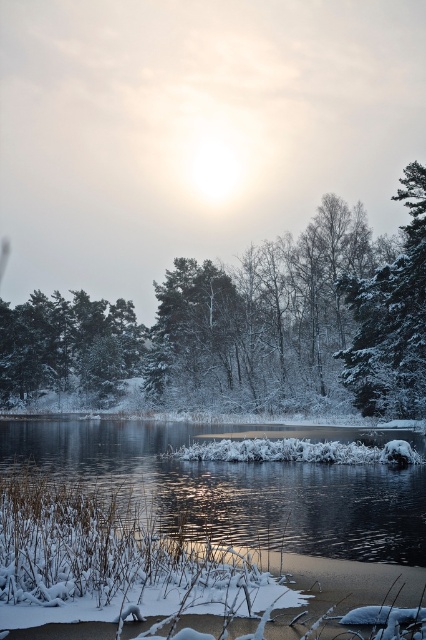
Which is above, snow-covered evergreen tree at right or green matte tree at upper left?

Answer: snow-covered evergreen tree at right is higher up.

Which is more to the left, snow-covered evergreen tree at right or green matte tree at upper left?

Positioned to the left is green matte tree at upper left.

Is point (396, 349) closer to camera compared to point (97, 314)?

That is True.

Find the location of a particular element. snow-covered evergreen tree at right is located at coordinates (391, 320).

Describe the element at coordinates (233, 490) in the screenshot. I see `clear ice water at lower center` at that location.

Which is more to the right, clear ice water at lower center or snow-covered evergreen tree at right?

snow-covered evergreen tree at right is more to the right.

Does point (28, 429) come closer to viewer compared to point (382, 330)?

That is False.

This screenshot has width=426, height=640. I want to click on clear ice water at lower center, so click(233, 490).

Can you confirm if clear ice water at lower center is bigger than green matte tree at upper left?

No.

Can you confirm if clear ice water at lower center is thinner than green matte tree at upper left?

No, clear ice water at lower center is not thinner than green matte tree at upper left.

This screenshot has width=426, height=640. I want to click on clear ice water at lower center, so click(x=233, y=490).